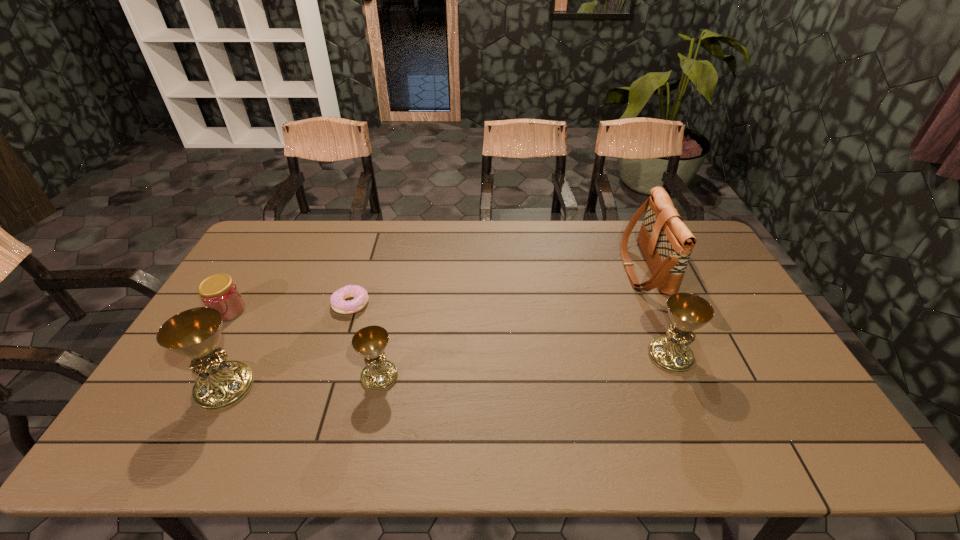
You are a GUI agent. You are given a task and a screenshot of the screen. Output one action in this format:
    pyautogui.click(x=<x>, y=<y>)
    Task: Click on the tallest chalice
    This screenshot has height=540, width=960.
    Given the screenshot: What is the action you would take?
    pyautogui.click(x=195, y=333)

The height and width of the screenshot is (540, 960). Identify the location of the shortest chalice. (371, 341).

The width and height of the screenshot is (960, 540). Find the location of `the fourth object from left to right`. the fourth object from left to right is located at coordinates (371, 341).

Image resolution: width=960 pixels, height=540 pixels. In order to click on the rightmost chalice in this screenshot , I will do `click(688, 312)`.

Where is `the third tallest object`? the third tallest object is located at coordinates coord(688,312).

The height and width of the screenshot is (540, 960). Identify the location of shoulder bag. (666, 242).

Image resolution: width=960 pixels, height=540 pixels. I want to click on the fifth tallest object, so click(x=219, y=291).

Image resolution: width=960 pixels, height=540 pixels. Find the location of `doughnut`. doughnut is located at coordinates (337, 300).

Locate an element on the screen. This screenshot has height=540, width=960. the third object from left to right is located at coordinates (337, 300).

Identify the location of vacant space located on the right of the leftmost chalice. (319, 387).